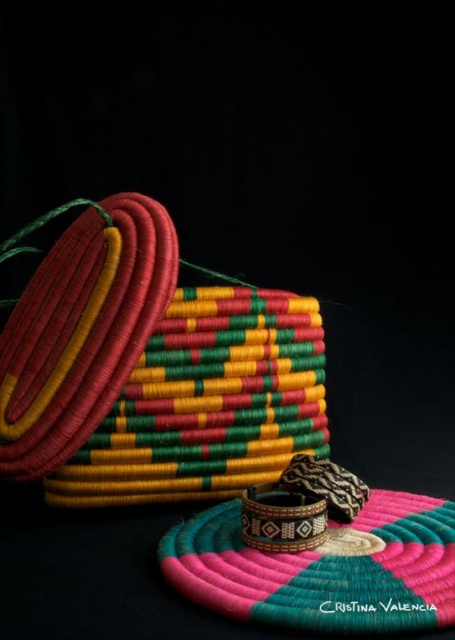
You are an art curator arranging an exhibition. You have two bracelets displayed in the image, the textured woven bracelet at left and the brown woven bracelet at center. Which bracelet is positioned closer to the viewer?

The textured woven bracelet at left is closer to the viewer because the brown woven bracelet at center is behind it.

You have a small decorative item that needs to be placed exactly 6 inches away from the bright multicolored woven basket at center. Can the textured woven bracelet at left be placed there?

The bright multicolored woven basket at center and textured woven bracelet at left are 6.01 inches apart, so the bracelet is just slightly more than 6 inches away. Therefore, it cannot be placed exactly at the 6 inch mark.

You are a jeweler who needs to place a new bracelet between the textured woven bracelet at left and the brown woven bracelet at center. The new bracelet is 3 inches wide. Can you fit it between them without overlapping?

The distance between the textured woven bracelet at left and the brown woven bracelet at center is 14.59 inches. Since the new bracelet is only 3 inches wide, there is sufficient space to place it between them without overlapping.